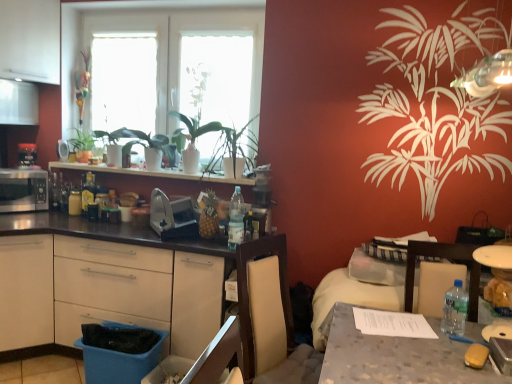
Question: Can you confirm if clear plastic bottle at table right, which is the first bottle from right to left, is shorter than metallic silver toaster at left, placed as the third appliance when sorted from right to left?

Choices:
 (A) yes
 (B) no

Answer: (A)

Question: Is clear plastic bottle at table right, which is the first bottle from right to left, bigger than metallic silver toaster at left, placed as the third appliance when sorted from right to left?

Choices:
 (A) yes
 (B) no

Answer: (B)

Question: Is clear plastic bottle at table right, the third bottle when ordered from back to front, at the left side of metallic silver toaster at left, placed as the 2th appliance when sorted from left to right?

Choices:
 (A) no
 (B) yes

Answer: (A)

Question: From a real-world perspective, is clear plastic bottle at table right, the 3th bottle when ordered from left to right, on metallic silver toaster at left, placed as the 2th appliance when sorted from left to right?

Choices:
 (A) yes
 (B) no

Answer: (B)

Question: Considering the relative positions of clear plastic bottle at table right, which is the first bottle from right to left, and metallic silver toaster at left, placed as the third appliance when sorted from right to left, in the image provided, is clear plastic bottle at table right, which is the first bottle from right to left, to the right of metallic silver toaster at left, placed as the third appliance when sorted from right to left, from the viewer's perspective?

Choices:
 (A) yes
 (B) no

Answer: (A)

Question: Can you confirm if clear plastic bottle at table right, the third bottle when ordered from back to front, is smaller than metallic silver toaster at left, placed as the 2th appliance when sorted from left to right?

Choices:
 (A) yes
 (B) no

Answer: (A)

Question: Does blue plastic drawer at lower left appear on the left side of clear plastic bottle at table right, which is the 1th bottle in front-to-back order?

Choices:
 (A) no
 (B) yes

Answer: (B)

Question: Can you confirm if blue plastic drawer at lower left is shorter than clear plastic bottle at table right, the 3th bottle when ordered from left to right?

Choices:
 (A) no
 (B) yes

Answer: (B)

Question: Is blue plastic drawer at lower left outside clear plastic bottle at table right, which is the 1th bottle in front-to-back order?

Choices:
 (A) yes
 (B) no

Answer: (A)

Question: Could you tell me if blue plastic drawer at lower left is turned towards clear plastic bottle at table right, which is the 1th bottle in front-to-back order?

Choices:
 (A) yes
 (B) no

Answer: (B)

Question: Considering the relative sizes of blue plastic drawer at lower left and clear plastic bottle at table right, which is the first bottle from right to left, in the image provided, is blue plastic drawer at lower left taller than clear plastic bottle at table right, which is the first bottle from right to left,?

Choices:
 (A) yes
 (B) no

Answer: (B)

Question: From the image's perspective, does blue plastic drawer at lower left appear higher than clear plastic bottle at table right, which is the first bottle from right to left?

Choices:
 (A) no
 (B) yes

Answer: (A)

Question: Is white matte window screen at upper center, which ranks as the 1th window screen in right-to-left order, positioned before clear plastic bottle at table right, which is the first bottle from right to left?

Choices:
 (A) no
 (B) yes

Answer: (A)